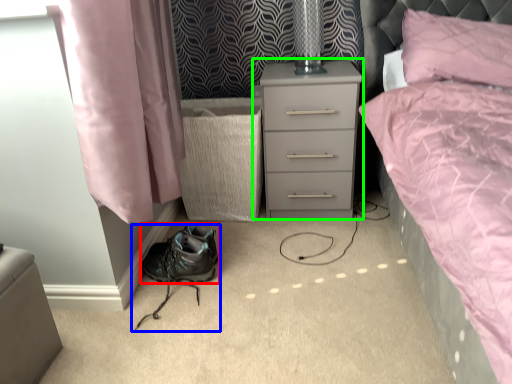
Question: Which object is the closest to the shoe (highlighted by a red box)? Choose among these: footwear (highlighted by a blue box) or nightstand (highlighted by a green box).

Choices:
 (A) footwear
 (B) nightstand

Answer: (A)